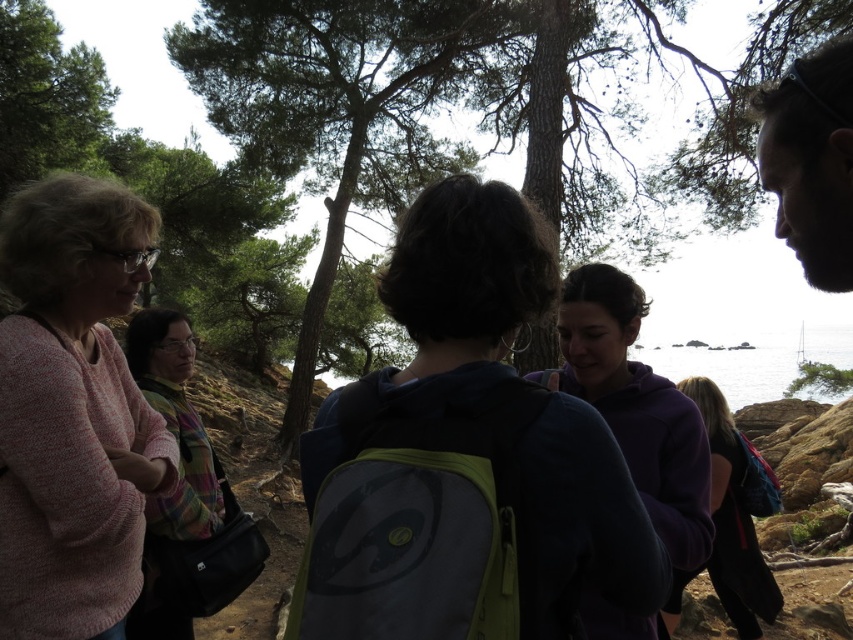
Question: Does green textured tree at center appear on the left side of multicolored knitted sweater at left?

Choices:
 (A) no
 (B) yes

Answer: (A)

Question: Is purple fleece jacket at lower right positioned in front of clear water at center?

Choices:
 (A) yes
 (B) no

Answer: (A)

Question: Among these points, which one is farthest from the camera?

Choices:
 (A) (672, 605)
 (B) (715, 360)
 (C) (637, 448)
 (D) (846, 243)

Answer: (B)

Question: Which of the following is the farthest from the observer?

Choices:
 (A) (585, 280)
 (B) (759, 492)
 (C) (231, 16)
 (D) (343, 458)

Answer: (C)

Question: Considering the relative positions of dark hair at upper right and purple fleece jacket at lower right in the image provided, where is dark hair at upper right located with respect to purple fleece jacket at lower right?

Choices:
 (A) left
 (B) right

Answer: (A)

Question: Which of these objects is positioned closest to the dark hair at upper right?

Choices:
 (A) pink knitted sweater at left
 (B) purple fleece jacket at lower right

Answer: (A)